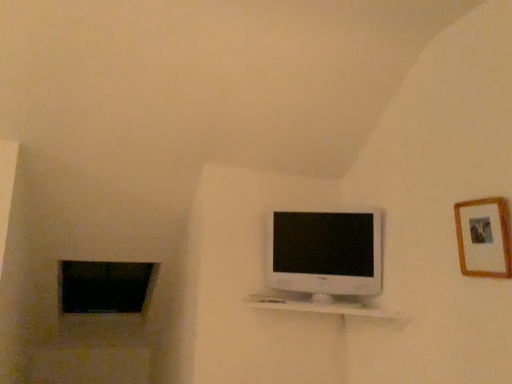
Question: Which is correct: white glossy television at center is inside white glossy shelf at center, or outside of it?

Choices:
 (A) inside
 (B) outside

Answer: (B)

Question: In the image, is white glossy television at center on the left side or the right side of white glossy shelf at center?

Choices:
 (A) right
 (B) left

Answer: (A)

Question: Estimate the real-world distances between objects in this image. Which object is closer to the white glossy television at center?

Choices:
 (A) white glossy shelf at center
 (B) black glass window at lower left
 (C) wooden picture frame at upper right

Answer: (A)

Question: Estimate the real-world distances between objects in this image. Which object is farther from the black glass window at lower left?

Choices:
 (A) white glossy television at center
 (B) white glossy shelf at center
 (C) wooden picture frame at upper right

Answer: (C)